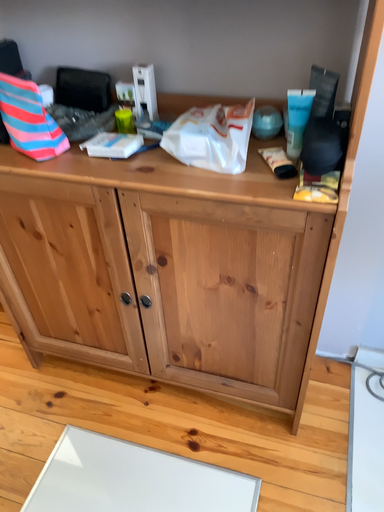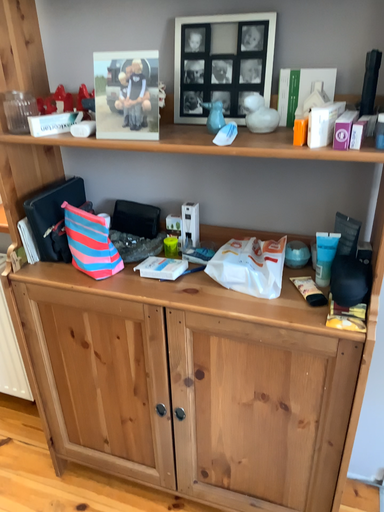
Question: Which way did the camera rotate in the video?

Choices:
 (A) rotated downward
 (B) rotated upward

Answer: (B)